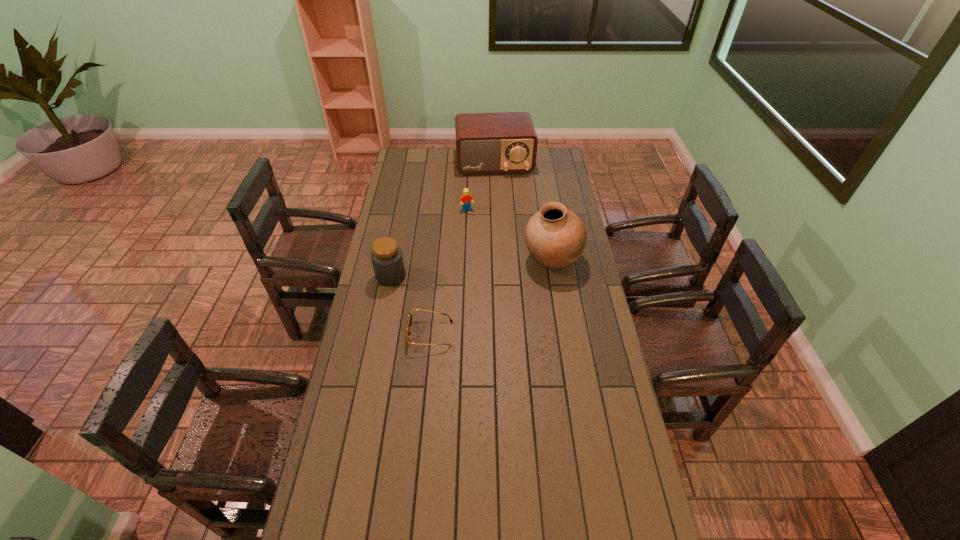
The height and width of the screenshot is (540, 960). Find the location of `vacant space positioned 0.070m on the front panel of the fourth shortest object`. vacant space positioned 0.070m on the front panel of the fourth shortest object is located at coordinates (498, 185).

Where is `vacant space located on the front panel of the fourth shortest object`? This screenshot has width=960, height=540. vacant space located on the front panel of the fourth shortest object is located at coordinates (501, 201).

I want to click on object that is at the far edge, so click(505, 142).

The height and width of the screenshot is (540, 960). I want to click on object positioned at the left edge, so click(386, 256).

Where is `object present at the right edge`? object present at the right edge is located at coordinates (555, 236).

This screenshot has width=960, height=540. In the image, there is a desktop. Identify the location of free space at the near edge. (545, 502).

Where is `vacant space at the left edge of the desktop`? Image resolution: width=960 pixels, height=540 pixels. vacant space at the left edge of the desktop is located at coordinates (392, 232).

At what (x,y) coordinates should I click in order to perform the action: click on vacant space at the right edge of the desktop. Please return your answer as a coordinate pair (x, y). The image size is (960, 540). Looking at the image, I should click on (581, 276).

This screenshot has width=960, height=540. I want to click on empty space between the sunglasses and the farthest object, so click(x=462, y=248).

Locate an element on the screen. free space between the jar and the fourth tallest object is located at coordinates (429, 243).